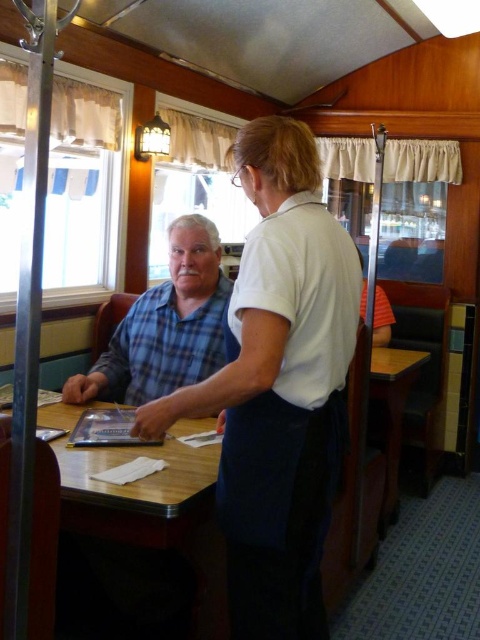
You are standing in the vintage diner scene and need to place a tray on the wooden table at center. Given that the table is at coordinates point 0.798, 0.325, can you confirm its exact position relative to the room?

The wooden table at center is located at point (156,509), which means it is positioned at that exact coordinate in the room.

You are a customer in this diner and want to place your coffee mug on the wooden table at center and the wooden table at lower right. Which table is higher up?

The wooden table at center is above the wooden table at lower right, so the wooden table at center is higher up.

You are a photographer positioned at the camera. You want to capture a portrait of the white cotton shirt at center. What is the minimum distance you should set your camera lens to focus on?

The minimum distance you should set your camera lens to focus on is 1.17 meters, as that is the distance between the white cotton shirt at center and the camera.